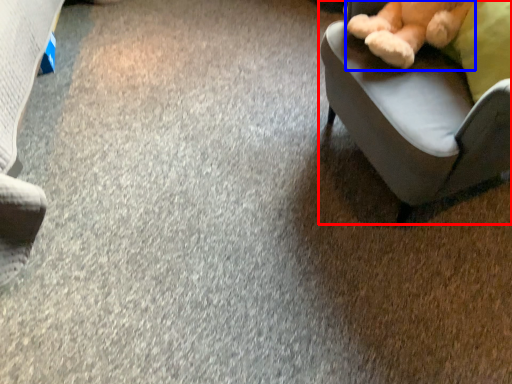
Question: Which object appears farthest to the camera in this image, chair (highlighted by a red box) or teddy bear (highlighted by a blue box)?

Choices:
 (A) chair
 (B) teddy bear

Answer: (B)